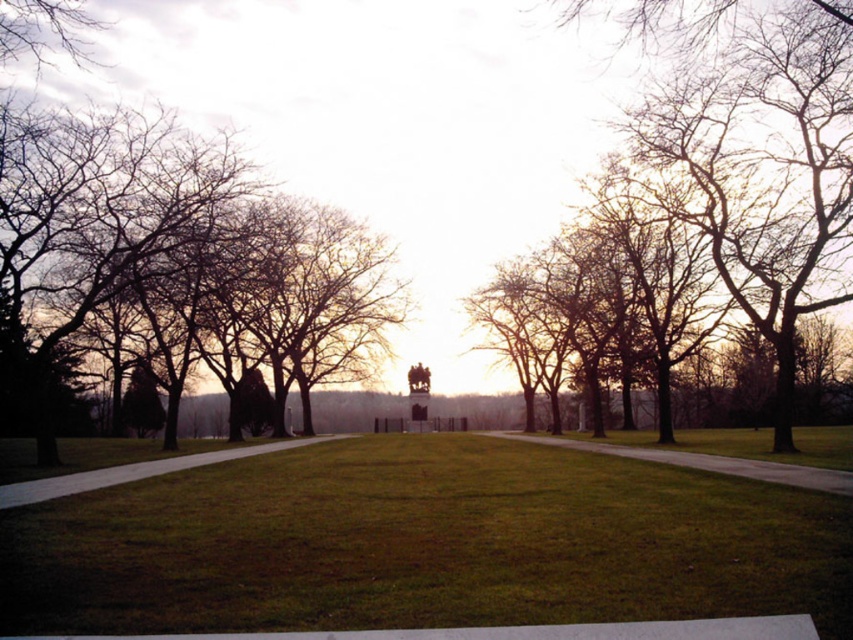
Looking at this image, you are standing at the entrance of the park and see the bare branches at center. If you walk straight ahead, will you encounter them before reaching the pathway that diverges into two directions?

The bare branches at center are located at point (763, 172), which is closer to the entrance than the diverging pathway. Therefore, you will encounter the bare branches at center before reaching the pathway that diverges into two directions.

You are walking along the grassy sidewalk at center and want to reach the brown leafless tree at left. Which direction should you head?

You should head to the left to reach the brown leafless tree at left since it is positioned to the left of the grassy sidewalk at center.

You are standing at the edge of the green grassy field at center and want to see if you can spot the top of the bare branches at center from there. Based on their heights, is this possible?

The green grassy field at center is shorter than the bare branches at center, so yes, you can see the top of the bare branches at center from the edge of the green grassy field at center because the branches are taller.